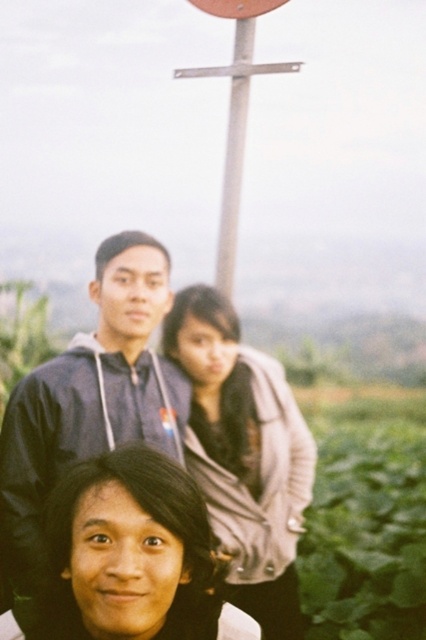
You are a photographer adjusting the camera settings to ensure both the dark blue hoodie at upper center and the light brown leather jacket at center are clearly visible. Based on their positions, which one might need more lighting adjustment to avoid being obscured?

The light brown leather jacket at center might need more lighting adjustment because it is behind the dark blue hoodie at upper center and could be partially obscured, requiring additional light to ensure visibility.

You are a photographer trying to adjust the framing of your shot. You notice the dark blue hoodie at upper center and the light brown leather jacket at center. Which of these two items has a smaller width in the current composition?

The dark blue hoodie at upper center has a smaller width than the light brown leather jacket at center according to the description.

You are a photographer trying to ensure all subjects are visible in the photo. The dark blue hoodie at upper center and the light brown leather jacket at center are two key elements. Which of these two items should you focus on to ensure they are in sharp focus, considering their sizes?

The dark blue hoodie at upper center is bigger than the light brown leather jacket at center, so focusing on the larger dark blue hoodie at upper center would ensure both are in sharp focus as it requires more attention due to its size.